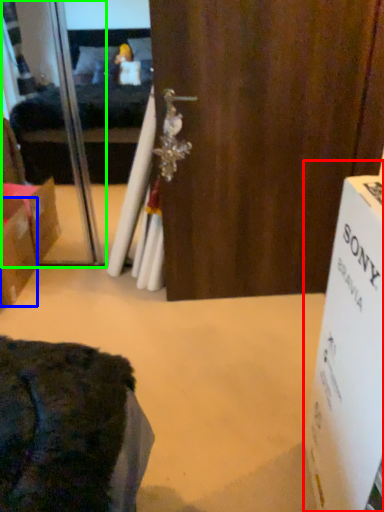
Question: Considering the real-world distances, which object is farthest from cardboard box (highlighted by a red box)? box (highlighted by a blue box) or screen door (highlighted by a green box)?

Choices:
 (A) box
 (B) screen door

Answer: (B)